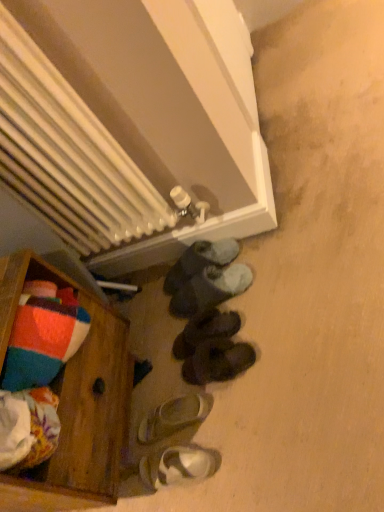
Locate an element on the screen. black suede slippers at center, which is counted as the third footwear, starting from the top is located at coordinates (205, 331).

What are the coordinates of `black suede shoes at lower center, which is the 4th footwear in top-to-bottom order` in the screenshot? It's located at (217, 361).

At what (x,y) coordinates should I click in order to perform the action: click on white matte sandals at lower center, arranged as the 1th footwear when ordered from the bottom. Please return your answer as a coordinate pair (x, y). Image resolution: width=384 pixels, height=512 pixels. Looking at the image, I should click on (177, 466).

What is the approximate width of white matte sandals at lower center, arranged as the 1th footwear when ordered from the bottom?

The width of white matte sandals at lower center, arranged as the 1th footwear when ordered from the bottom, is 10.26 inches.

What do you see at coordinates (173, 417) in the screenshot? The height and width of the screenshot is (512, 384). I see `white matte sandal at lower center, which ranks as the 2th footwear in bottom-to-top order` at bounding box center [173, 417].

Where is `white matte sandal at lower center, which is the fifth footwear from top to bottom`? white matte sandal at lower center, which is the fifth footwear from top to bottom is located at coordinates (173, 417).

The image size is (384, 512). What are the coordinates of `black suede slippers at center, which appears as the 4th footwear when ordered from the bottom` in the screenshot? It's located at (205, 331).

Considering the positions of objects black suede slippers at center, which appears as the 4th footwear when ordered from the bottom, and white metallic radiator at upper center in the image provided, who is more to the left, black suede slippers at center, which appears as the 4th footwear when ordered from the bottom, or white metallic radiator at upper center?

white metallic radiator at upper center.

From the image's perspective, relative to white metallic radiator at upper center, is black suede slippers at center, which is counted as the third footwear, starting from the top, above or below?

Based on their image positions, black suede slippers at center, which is counted as the third footwear, starting from the top, is located beneath white metallic radiator at upper center.

Is black suede slippers at center, which is counted as the third footwear, starting from the top, facing towards white metallic radiator at upper center?

No, black suede slippers at center, which is counted as the third footwear, starting from the top, is not turned towards white metallic radiator at upper center.

Between black suede slippers at center, which is counted as the third footwear, starting from the top, and white metallic radiator at upper center, which one is positioned behind?

black suede slippers at center, which is counted as the third footwear, starting from the top, is behind.

Between blue fuzzy slippers at center, the first footwear from the top, and white matte sandal at lower center, which ranks as the 2th footwear in bottom-to-top order, which one is positioned behind?

blue fuzzy slippers at center, the first footwear from the top.

Between blue fuzzy slippers at center, the first footwear from the top, and white matte sandal at lower center, which is the fifth footwear from top to bottom, which one has smaller width?

With smaller width is white matte sandal at lower center, which is the fifth footwear from top to bottom.

Consider the image. Is blue fuzzy slippers at center, the first footwear from the top, far from white matte sandal at lower center, which ranks as the 2th footwear in bottom-to-top order?

No, there isn't a large distance between blue fuzzy slippers at center, the first footwear from the top, and white matte sandal at lower center, which ranks as the 2th footwear in bottom-to-top order.

Looking at this image, from the image's perspective, which object appears higher, blue fuzzy slippers at center, the sixth footwear positioned from the bottom, or white matte sandal at lower center, which is the fifth footwear from top to bottom?

From the image's view, blue fuzzy slippers at center, the sixth footwear positioned from the bottom, is above.

The image size is (384, 512). I want to click on the 1st footwear below when counting from the white metallic radiator at upper center (from the image's perspective), so click(x=200, y=261).

In the image, is blue fuzzy slippers at center, the first footwear from the top, positioned in front of or behind white metallic radiator at upper center?

blue fuzzy slippers at center, the first footwear from the top, is positioned farther from the viewer than white metallic radiator at upper center.

Can we say blue fuzzy slippers at center, the sixth footwear positioned from the bottom, lies outside white metallic radiator at upper center?

Yes, blue fuzzy slippers at center, the sixth footwear positioned from the bottom, is outside of white metallic radiator at upper center.

Considering the sizes of blue fuzzy slippers at center, the sixth footwear positioned from the bottom, and white metallic radiator at upper center in the image, is blue fuzzy slippers at center, the sixth footwear positioned from the bottom, wider or thinner than white metallic radiator at upper center?

blue fuzzy slippers at center, the sixth footwear positioned from the bottom, is wider than white metallic radiator at upper center.

Is point (183, 455) closer or farther from the camera than point (72, 364)?

Point (183, 455) appears to be farther away from the viewer than point (72, 364).

Considering the sizes of objects white matte sandals at lower center, placed as the sixth footwear when sorted from top to bottom, and wooden chest at lower left in the image provided, who is wider, white matte sandals at lower center, placed as the sixth footwear when sorted from top to bottom, or wooden chest at lower left?

wooden chest at lower left.

Is white matte sandals at lower center, arranged as the 1th footwear when ordered from the bottom, far from wooden chest at lower left?

No, white matte sandals at lower center, arranged as the 1th footwear when ordered from the bottom, is in close proximity to wooden chest at lower left.

Which of these two, white matte sandals at lower center, arranged as the 1th footwear when ordered from the bottom, or wooden chest at lower left, is smaller?

white matte sandals at lower center, arranged as the 1th footwear when ordered from the bottom.

Which is behind, point (202, 330) or point (189, 365)?

The point (202, 330) is farther from the camera.

Which is more to the left, black suede slippers at center, which appears as the 4th footwear when ordered from the bottom, or black suede shoes at lower center, which is the 3th footwear from bottom to top?

black suede slippers at center, which appears as the 4th footwear when ordered from the bottom, is more to the left.

Does black suede slippers at center, which is counted as the third footwear, starting from the top, have a smaller size compared to black suede shoes at lower center, which is the 4th footwear in top-to-bottom order?

No.

Is the surface of wooden chest at lower left in direct contact with white metallic radiator at upper center?

No, wooden chest at lower left is not beside white metallic radiator at upper center.

Does point (105, 339) lie behind point (164, 57)?

Yes.

Is wooden chest at lower left inside the boundaries of white metallic radiator at upper center, or outside?

wooden chest at lower left is not enclosed by white metallic radiator at upper center.

From a real-world perspective, which is physically below, white matte sandal at lower center, which is the fifth footwear from top to bottom, or white matte sandals at lower center, placed as the sixth footwear when sorted from top to bottom?

white matte sandal at lower center, which is the fifth footwear from top to bottom, is physically lower.

Would you consider white matte sandal at lower center, which ranks as the 2th footwear in bottom-to-top order, to be distant from white matte sandals at lower center, placed as the sixth footwear when sorted from top to bottom?

That's not correct — white matte sandal at lower center, which ranks as the 2th footwear in bottom-to-top order, is a little close to white matte sandals at lower center, placed as the sixth footwear when sorted from top to bottom.

Which object is closer to the camera taking this photo, white matte sandal at lower center, which is the fifth footwear from top to bottom, or white matte sandals at lower center, placed as the sixth footwear when sorted from top to bottom?

Positioned in front is white matte sandals at lower center, placed as the sixth footwear when sorted from top to bottom.

From their relative heights in the image, would you say white matte sandal at lower center, which is the fifth footwear from top to bottom, is taller or shorter than white matte sandals at lower center, arranged as the 1th footwear when ordered from the bottom?

Considering their sizes, white matte sandal at lower center, which is the fifth footwear from top to bottom, has less height than white matte sandals at lower center, arranged as the 1th footwear when ordered from the bottom.

The height and width of the screenshot is (512, 384). I want to click on footwear that is the 4th object located behind the white metallic radiator at upper center, so click(x=205, y=331).

This screenshot has width=384, height=512. I want to click on footwear that is the 2nd one when counting rightward from the white matte sandal at lower center, which is the fifth footwear from top to bottom, so click(200, 261).

Considering their positions, is black suede slippers at center, which is counted as the third footwear, starting from the top, positioned closer to blue fuzzy slippers at center, the sixth footwear positioned from the bottom, than wooden chest at lower left?

black suede slippers at center, which is counted as the third footwear, starting from the top, is closer to blue fuzzy slippers at center, the sixth footwear positioned from the bottom.

Estimate the real-world distances between objects in this image. Which object is closer to white matte sandal at lower center, which ranks as the 2th footwear in bottom-to-top order, white matte sandals at lower center, arranged as the 1th footwear when ordered from the bottom, or black suede slippers at center, which is counted as the third footwear, starting from the top?

white matte sandals at lower center, arranged as the 1th footwear when ordered from the bottom, is closer to white matte sandal at lower center, which ranks as the 2th footwear in bottom-to-top order.

From the image, which object appears to be nearer to black suede slippers at center, which is counted as the third footwear, starting from the top, wooden chest at lower left or dark gray suede slippers at lower center, the second footwear positioned from the top?

Based on the image, dark gray suede slippers at lower center, the second footwear positioned from the top, appears to be nearer to black suede slippers at center, which is counted as the third footwear, starting from the top.

Which object lies further to the anchor point dark gray suede slippers at lower center, which is the 5th footwear from bottom to top, black suede shoes at lower center, which is the 4th footwear in top-to-bottom order, or white metallic radiator at upper center?

white metallic radiator at upper center is further to dark gray suede slippers at lower center, which is the 5th footwear from bottom to top.

Based on the photo, estimate the real-world distances between objects in this image. Which object is further from white matte sandal at lower center, which ranks as the 2th footwear in bottom-to-top order, white matte sandals at lower center, arranged as the 1th footwear when ordered from the bottom, or blue fuzzy slippers at center, the sixth footwear positioned from the bottom?

blue fuzzy slippers at center, the sixth footwear positioned from the bottom, is further to white matte sandal at lower center, which ranks as the 2th footwear in bottom-to-top order.

From the picture: From the image, which object appears to be farther from blue fuzzy slippers at center, the first footwear from the top, black suede slippers at center, which is counted as the third footwear, starting from the top, or black suede shoes at lower center, which is the 3th footwear from bottom to top?

The object further to blue fuzzy slippers at center, the first footwear from the top, is black suede shoes at lower center, which is the 3th footwear from bottom to top.

Looking at the image, which one is located further to black suede shoes at lower center, which is the 4th footwear in top-to-bottom order, dark gray suede slippers at lower center, which is the 5th footwear from bottom to top, or wooden chest at lower left?

wooden chest at lower left is further to black suede shoes at lower center, which is the 4th footwear in top-to-bottom order.

From the image, which object appears to be farther from black suede slippers at center, which appears as the 4th footwear when ordered from the bottom, white matte sandals at lower center, arranged as the 1th footwear when ordered from the bottom, or wooden chest at lower left?

wooden chest at lower left lies further to black suede slippers at center, which appears as the 4th footwear when ordered from the bottom, than the other object.

Identify the location of radiator positioned between wooden chest at lower left and blue fuzzy slippers at center, the first footwear from the top, from near to far. Image resolution: width=384 pixels, height=512 pixels. (132, 125).

This screenshot has height=512, width=384. In order to click on footwear between black suede shoes at lower center, which is the 3th footwear from bottom to top, and white matte sandals at lower center, placed as the sixth footwear when sorted from top to bottom, from top to bottom in this screenshot , I will do `click(173, 417)`.

Find the location of a particular element. The width and height of the screenshot is (384, 512). furniture between white metallic radiator at upper center and white matte sandal at lower center, which is the fifth footwear from top to bottom, vertically is located at coordinates (76, 398).

This screenshot has width=384, height=512. Find the location of `footwear between blue fuzzy slippers at center, the sixth footwear positioned from the bottom, and black suede slippers at center, which is counted as the third footwear, starting from the top, vertically`. footwear between blue fuzzy slippers at center, the sixth footwear positioned from the bottom, and black suede slippers at center, which is counted as the third footwear, starting from the top, vertically is located at coordinates (210, 289).